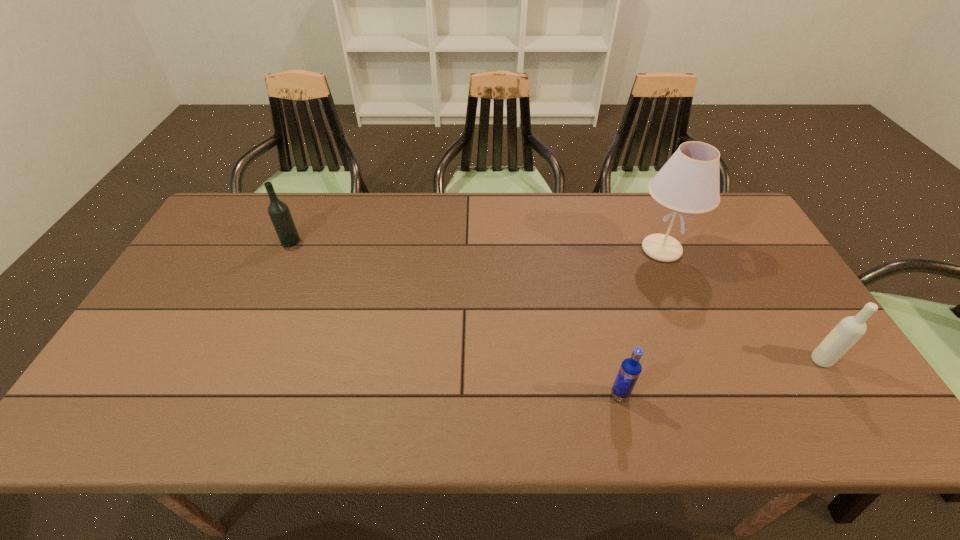
I want to click on empty space between the farthest vodka and the third farthest object, so click(556, 301).

Locate an element on the screen. the closest object relative to the second farthest vodka is located at coordinates (689, 182).

Identify the location of object that stands as the third closest to the leftmost object. This screenshot has width=960, height=540. 849,330.

At what (x,y) coordinates should I click in order to perform the action: click on vodka that is the second closest to the shortest vodka. Please return your answer as a coordinate pair (x, y). Looking at the image, I should click on (279, 213).

Identify which vodka is located as the third nearest to the lampshade. Please provide its 2D coordinates. Your answer should be formatted as a tuple, i.e. [(x, y)], where the tuple contains the x and y coordinates of a point satisfying the conditions above.

[(279, 213)]

Find the location of a particular element. The height and width of the screenshot is (540, 960). vacant region that satisfies the following two spatial constraints: 1. on the back side of the nearest object; 2. on the left side of the second nearest object is located at coordinates point(611,360).

You are a GUI agent. You are given a task and a screenshot of the screen. Output one action in this format:
    pyautogui.click(x=<x>, y=<y>)
    Task: Click on the free space that satisfies the following two spatial constraints: 1. on the back side of the shortest vodka; 2. on the left side of the second nearest vodka
    The width and height of the screenshot is (960, 540).
    Given the screenshot: What is the action you would take?
    pyautogui.click(x=611, y=360)

In order to click on vacant space that satisfies the following two spatial constraints: 1. on the back side of the third object from left to right; 2. on the right side of the second vodka from left to right in this screenshot , I will do `click(585, 250)`.